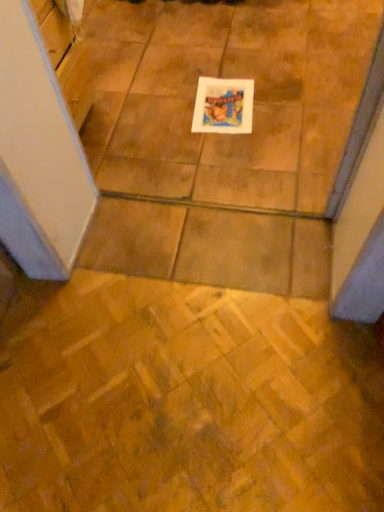
Locate an element on the screen. This screenshot has height=512, width=384. free area below white paper at center (from a real-world perspective) is located at coordinates (227, 106).